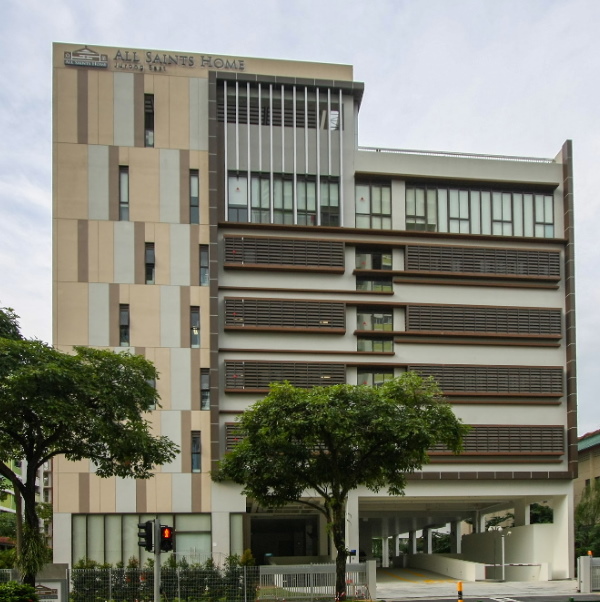
Locate an element on the screen. This screenshot has width=600, height=602. windows is located at coordinates (192, 560), (124, 560).